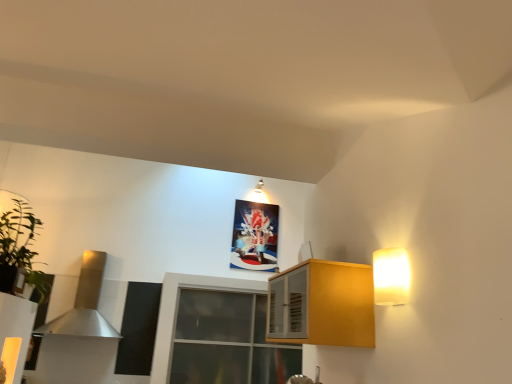
The height and width of the screenshot is (384, 512). What do you see at coordinates (84, 304) in the screenshot? I see `satin gold exhaust hood at left` at bounding box center [84, 304].

Image resolution: width=512 pixels, height=384 pixels. In order to click on satin gold exhaust hood at left in this screenshot , I will do `click(84, 304)`.

The height and width of the screenshot is (384, 512). I want to click on yellow matte cabinet at right, so click(322, 305).

Describe the element at coordinates (322, 305) in the screenshot. I see `yellow matte cabinet at right` at that location.

What is the approximate height of transparent glass window at center?

It is 3.38 feet.

Describe the element at coordinates (391, 276) in the screenshot. I see `warm matte wall sconce at upper right, positioned as the second light fixture in back-to-front order` at that location.

Identify the location of satin gold exhaust hood at left. This screenshot has width=512, height=384. (84, 304).

Is transparent glass window at center positioned in front of warm matte wall sconce at upper right, which ranks as the second light fixture in left-to-right order?

No.

Which of these two, transparent glass window at center or warm matte wall sconce at upper right, which ranks as the second light fixture in left-to-right order, stands shorter?

warm matte wall sconce at upper right, which ranks as the second light fixture in left-to-right order.

What's the angular difference between transparent glass window at center and warm matte wall sconce at upper right, which ranks as the second light fixture in left-to-right order,'s facing directions?

91 degrees.

From a real-world perspective, is transparent glass window at center on top of warm matte wall sconce at upper right, marked as the second light fixture in a top-to-bottom arrangement?

No, from a real-world perspective, transparent glass window at center is not on top of warm matte wall sconce at upper right, marked as the second light fixture in a top-to-bottom arrangement.

Which is more to the left, white glossy light fixture at upper center, which appears as the 1th light fixture when viewed from the back, or transparent glass window at center?

Positioned to the left is transparent glass window at center.

Considering their positions, is white glossy light fixture at upper center, which ranks as the second light fixture in right-to-left order, located in front of or behind transparent glass window at center?

white glossy light fixture at upper center, which ranks as the second light fixture in right-to-left order, is behind transparent glass window at center.

Is point (261, 179) more distant than point (240, 280)?

Yes, it is behind point (240, 280).

Is white glossy light fixture at upper center, which appears as the 1th light fixture when viewed from the back, not near transparent glass window at center?

Yes, white glossy light fixture at upper center, which appears as the 1th light fixture when viewed from the back, and transparent glass window at center are quite far apart.

Is matte plastic picture frame at upper center at the left side of yellow matte cabinet at right?

Correct, you'll find matte plastic picture frame at upper center to the left of yellow matte cabinet at right.

Does matte plastic picture frame at upper center have a larger size compared to yellow matte cabinet at right?

No, matte plastic picture frame at upper center is not bigger than yellow matte cabinet at right.

From the image's perspective, is matte plastic picture frame at upper center located above or below yellow matte cabinet at right?

matte plastic picture frame at upper center is above yellow matte cabinet at right.

Who is more distant, matte plastic picture frame at upper center or yellow matte cabinet at right?

matte plastic picture frame at upper center.

Which object is further away from the camera taking this photo, yellow matte cabinet at right or white glossy light fixture at upper center, which ranks as the second light fixture in right-to-left order?

white glossy light fixture at upper center, which ranks as the second light fixture in right-to-left order, is further away from the camera.

Looking at the image, does yellow matte cabinet at right seem bigger or smaller compared to white glossy light fixture at upper center, the first light fixture when ordered from left to right?

Clearly, yellow matte cabinet at right is larger in size than white glossy light fixture at upper center, the first light fixture when ordered from left to right.

Is white glossy light fixture at upper center, which appears as the 1th light fixture when viewed from the back, at the back of yellow matte cabinet at right?

That's not correct — yellow matte cabinet at right is not looking away from white glossy light fixture at upper center, which appears as the 1th light fixture when viewed from the back.

Would you say green leafy plant at left is part of matte plastic picture frame at upper center's contents?

No, green leafy plant at left is located outside of matte plastic picture frame at upper center.

How much distance is there between matte plastic picture frame at upper center and green leafy plant at left?

The distance of matte plastic picture frame at upper center from green leafy plant at left is 9.39 feet.

Could you tell me if matte plastic picture frame at upper center is facing green leafy plant at left?

No, matte plastic picture frame at upper center is not turned towards green leafy plant at left.

From a real-world perspective, which is physically below, matte plastic picture frame at upper center or green leafy plant at left?

green leafy plant at left is physically lower.

Between warm matte wall sconce at upper right, positioned as the second light fixture in back-to-front order, and white glossy light fixture at upper center, which appears as the 1th light fixture when viewed from the back, which one has larger width?

white glossy light fixture at upper center, which appears as the 1th light fixture when viewed from the back.

At what (x,y) coordinates should I click in order to perform the action: click on light fixture that is behind the warm matte wall sconce at upper right, which ranks as the 1th light fixture in right-to-left order. Please return your answer as a coordinate pair (x, y). The image size is (512, 384). Looking at the image, I should click on (259, 186).

Which object is more forward, warm matte wall sconce at upper right, positioned as the second light fixture in back-to-front order, or white glossy light fixture at upper center, which appears as the 1th light fixture when viewed from the back?

warm matte wall sconce at upper right, positioned as the second light fixture in back-to-front order, is more forward.

From a real-world perspective, which is physically above, warm matte wall sconce at upper right, which ranks as the 1th light fixture in right-to-left order, or white glossy light fixture at upper center, which ranks as the second light fixture in right-to-left order?

white glossy light fixture at upper center, which ranks as the second light fixture in right-to-left order, is physically above.

Is transparent glass window at center further to camera compared to satin gold exhaust hood at left?

No, the depth of transparent glass window at center is less than that of satin gold exhaust hood at left.

Is transparent glass window at center at the left side of satin gold exhaust hood at left?

Incorrect, transparent glass window at center is not on the left side of satin gold exhaust hood at left.

Is transparent glass window at center taller than satin gold exhaust hood at left?

No, transparent glass window at center is not taller than satin gold exhaust hood at left.

Considering the sizes of objects transparent glass window at center and satin gold exhaust hood at left in the image provided, who is bigger, transparent glass window at center or satin gold exhaust hood at left?

With larger size is transparent glass window at center.

Locate an element on the screen. Image resolution: width=512 pixels, height=384 pixels. window below the warm matte wall sconce at upper right, marked as the second light fixture in a top-to-bottom arrangement (from the image's perspective) is located at coordinates (217, 334).

Identify the location of window that is under the white glossy light fixture at upper center, arranged as the 2th light fixture when ordered from the bottom (from a real-world perspective). This screenshot has height=384, width=512. (217, 334).

From the image, which object appears to be nearer to yellow matte cabinet at right, green leafy plant at left or warm matte wall sconce at upper right, which ranks as the second light fixture in left-to-right order?

Among the two, warm matte wall sconce at upper right, which ranks as the second light fixture in left-to-right order, is located nearer to yellow matte cabinet at right.

When comparing their distances from matte plastic picture frame at upper center, does white glossy light fixture at upper center, the first light fixture when ordered from left to right, or transparent glass window at center seem closer?

Based on the image, white glossy light fixture at upper center, the first light fixture when ordered from left to right, appears to be nearer to matte plastic picture frame at upper center.

When comparing their distances from matte plastic picture frame at upper center, does yellow matte cabinet at right or satin gold exhaust hood at left seem closer?

Among the two, satin gold exhaust hood at left is located nearer to matte plastic picture frame at upper center.

When comparing their distances from matte plastic picture frame at upper center, does transparent glass window at center or satin gold exhaust hood at left seem further?

The object further to matte plastic picture frame at upper center is satin gold exhaust hood at left.

Based on their spatial positions, is matte plastic picture frame at upper center or transparent glass window at center further from warm matte wall sconce at upper right, which ranks as the 1th light fixture in right-to-left order?

The object further to warm matte wall sconce at upper right, which ranks as the 1th light fixture in right-to-left order, is matte plastic picture frame at upper center.

Estimate the real-world distances between objects in this image. Which object is closer to green leafy plant at left, yellow matte cabinet at right or transparent glass window at center?

yellow matte cabinet at right is closer to green leafy plant at left.

Estimate the real-world distances between objects in this image. Which object is closer to transparent glass window at center, matte plastic picture frame at upper center or warm matte wall sconce at upper right, which ranks as the second light fixture in left-to-right order?

matte plastic picture frame at upper center is closer to transparent glass window at center.

Consider the image. Which object lies nearer to the anchor point warm matte wall sconce at upper right, marked as the second light fixture in a top-to-bottom arrangement, matte plastic picture frame at upper center or green leafy plant at left?

green leafy plant at left is positioned closer to the anchor warm matte wall sconce at upper right, marked as the second light fixture in a top-to-bottom arrangement.

The width and height of the screenshot is (512, 384). Identify the location of picture frame between white glossy light fixture at upper center, arranged as the 2th light fixture when ordered from the bottom, and transparent glass window at center vertically. (255, 236).

Find the location of `houseplant between yellow matte cabinet at right and matte plastic picture frame at upper center along the z-axis`. houseplant between yellow matte cabinet at right and matte plastic picture frame at upper center along the z-axis is located at coordinates (19, 250).

Locate an element on the screen. cabinetry positioned between warm matte wall sconce at upper right, which ranks as the 1th light fixture in right-to-left order, and transparent glass window at center from near to far is located at coordinates (322, 305).

You are a GUI agent. You are given a task and a screenshot of the screen. Output one action in this format:
    pyautogui.click(x=<x>, y=<y>)
    Task: Click on the window situated between satin gold exhaust hood at left and white glossy light fixture at upper center, which appears as the second light fixture when viewed from the front, from left to right
    The width and height of the screenshot is (512, 384).
    Given the screenshot: What is the action you would take?
    click(217, 334)